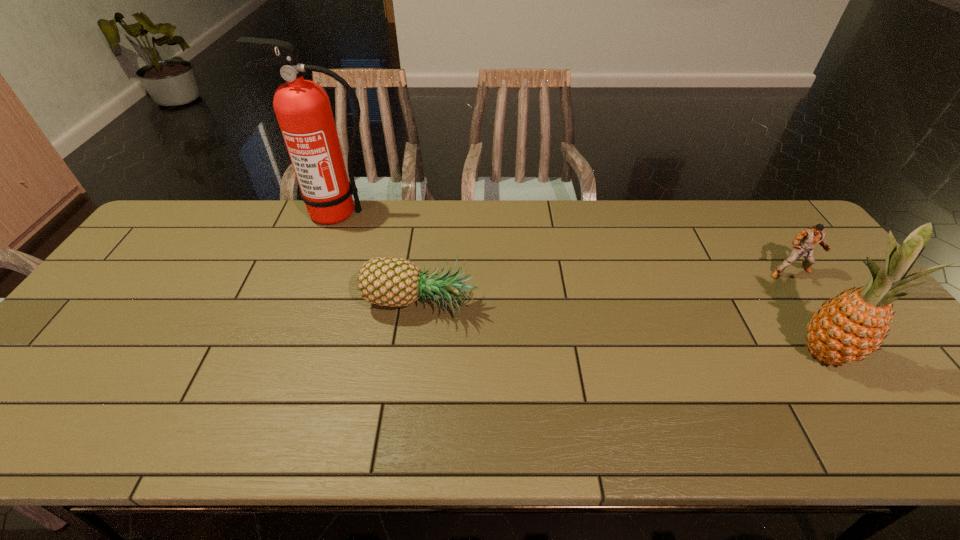
Where is `vacant space that satisfies the following two spatial constraints: 1. on the handle side of the second object from left to right; 2. on the right side of the fire extinguisher`? vacant space that satisfies the following two spatial constraints: 1. on the handle side of the second object from left to right; 2. on the right side of the fire extinguisher is located at coordinates (303, 307).

This screenshot has height=540, width=960. I want to click on free location that satisfies the following two spatial constraints: 1. on the handle side of the shorter pineapple; 2. on the left side of the tallest object, so (303, 307).

The height and width of the screenshot is (540, 960). I want to click on vacant position in the image that satisfies the following two spatial constraints: 1. on the handle side of the taller pineapple; 2. on the right side of the fire extinguisher, so click(x=285, y=354).

Image resolution: width=960 pixels, height=540 pixels. I want to click on free region that satisfies the following two spatial constraints: 1. on the handle side of the fire extinguisher; 2. on the right side of the shorter pineapple, so click(x=303, y=307).

Find the location of `vacant space that satisfies the following two spatial constraints: 1. on the handle side of the third shortest object; 2. on the right side of the leftmost object`. vacant space that satisfies the following two spatial constraints: 1. on the handle side of the third shortest object; 2. on the right side of the leftmost object is located at coordinates (285, 354).

Find the location of a particular element. vacant area in the image that satisfies the following two spatial constraints: 1. on the handle side of the leftmost object; 2. on the left side of the left pineapple is located at coordinates (303, 307).